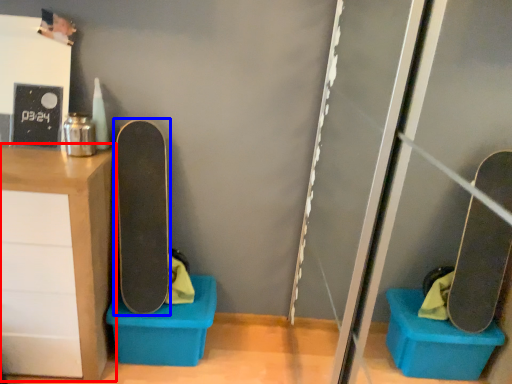
Question: Which point is further to the camera, furniture (highlighted by a red box) or skateboard (highlighted by a blue box)?

Choices:
 (A) furniture
 (B) skateboard

Answer: (B)